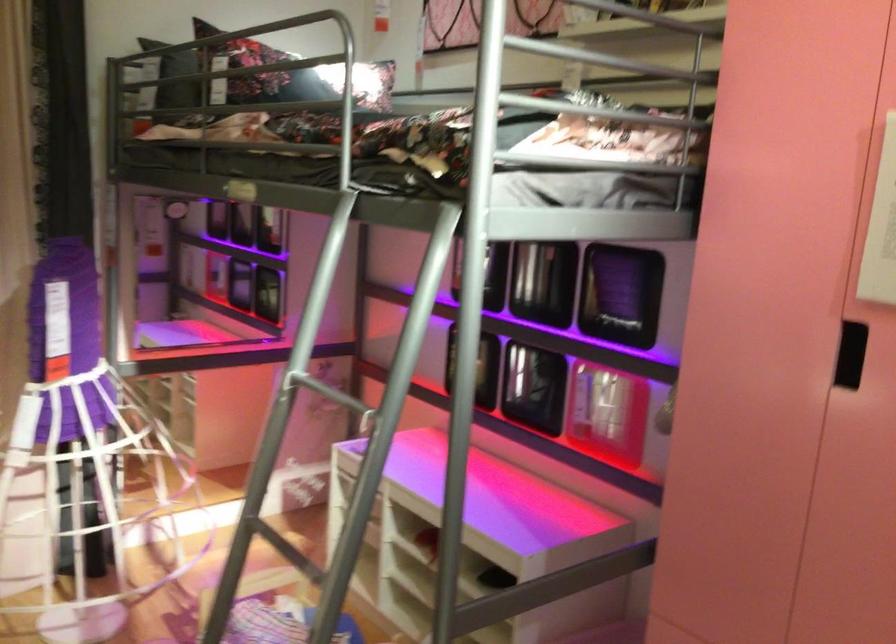
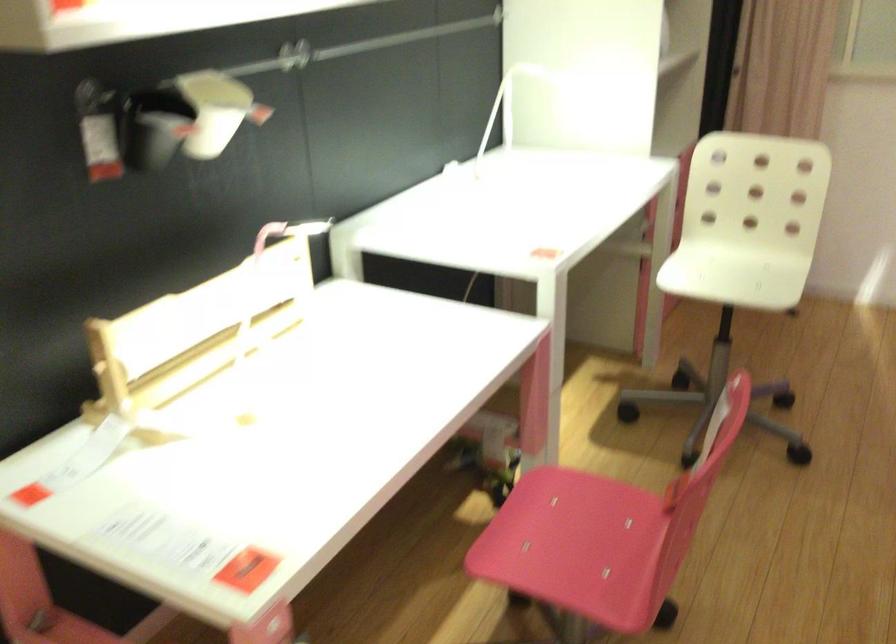
Based on the continuous images, in which direction is the camera rotating?

The camera rotated toward left-down.